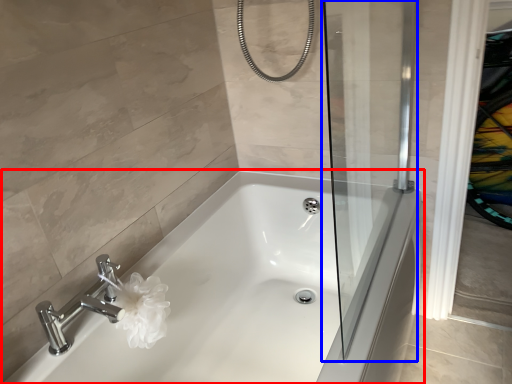
Question: Which object is closer to the camera taking this photo, bathtub (highlighted by a red box) or screen door (highlighted by a blue box)?

Choices:
 (A) bathtub
 (B) screen door

Answer: (B)